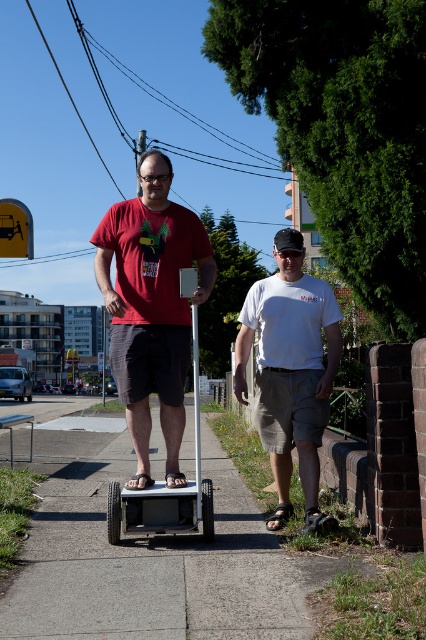
Question: Which point is farther from the camera taking this photo?

Choices:
 (A) (169, 435)
 (B) (221, 516)

Answer: (B)

Question: Considering the relative positions of matte red t-shirt at center and white matte shirt at center in the image provided, where is matte red t-shirt at center located with respect to white matte shirt at center?

Choices:
 (A) left
 (B) right

Answer: (A)

Question: Is concrete at center to the right of white matte scooter at center from the viewer's perspective?

Choices:
 (A) yes
 (B) no

Answer: (B)

Question: Where is concrete at center located in relation to white matte scooter at center in the image?

Choices:
 (A) left
 (B) right

Answer: (A)

Question: Which point is closer to the camera?

Choices:
 (A) matte red t-shirt at center
 (B) concrete at center
 (C) white matte shirt at center
 (D) white matte scooter at center

Answer: (B)

Question: Which object appears closest to the camera in this image?

Choices:
 (A) white matte scooter at center
 (B) matte red t-shirt at center
 (C) white matte shirt at center
 (D) concrete at center

Answer: (D)